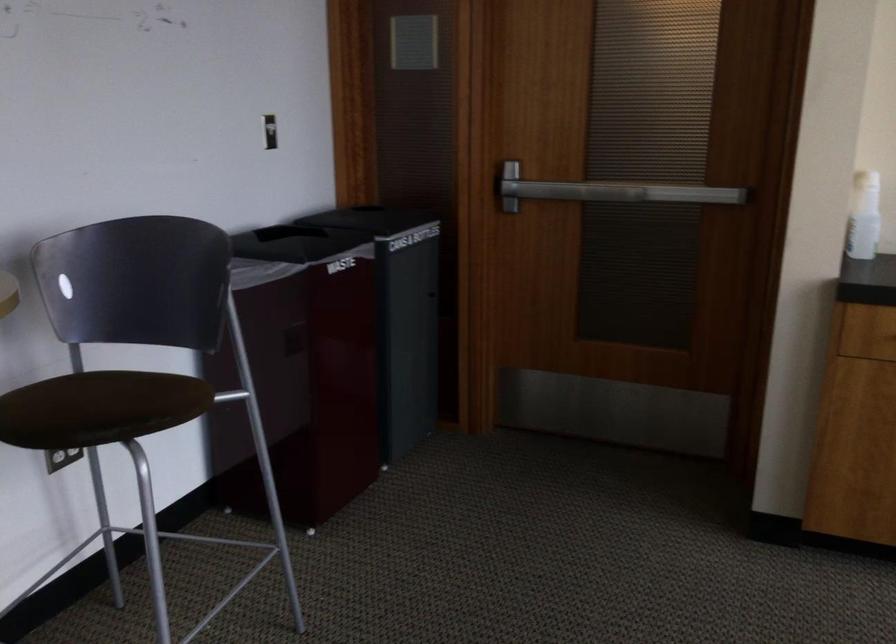
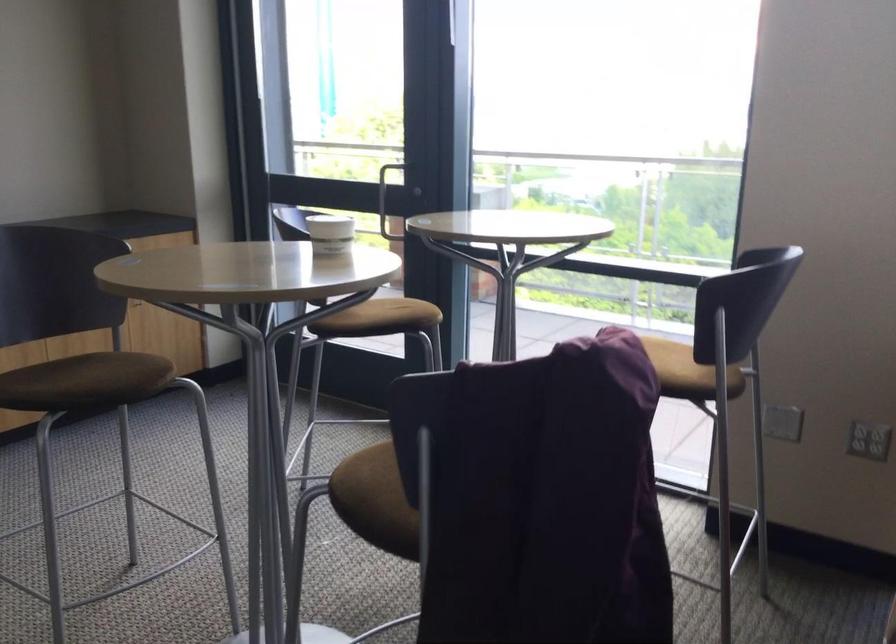
Question: The camera is either moving clockwise (left) or counter-clockwise (right) around the object. The first image is from the beginning of the video and the second image is from the end. Is the camera moving left or right when shooting the video?

Choices:
 (A) Left
 (B) Right

Answer: (A)